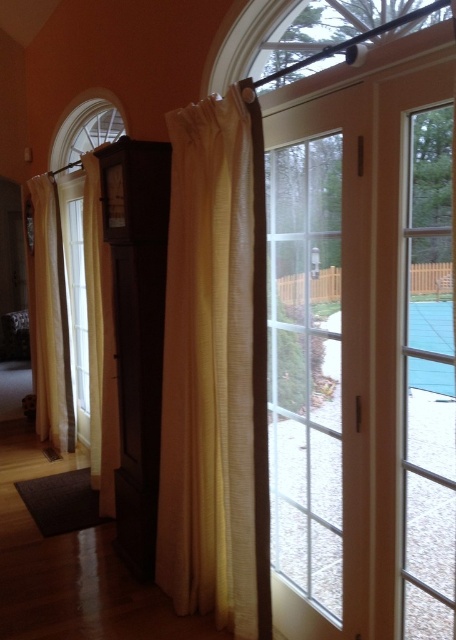
Question: Where is yellow sheer curtain at center located in relation to beige textured curtain at left in the image?

Choices:
 (A) right
 (B) left

Answer: (A)

Question: Does light beige sheer curtain at left come in front of beige textured curtain at left?

Choices:
 (A) yes
 (B) no

Answer: (B)

Question: Which of these objects is positioned closest to the yellow sheer curtain at center?

Choices:
 (A) light beige sheer curtain at left
 (B) clear glass door at right
 (C) beige textured curtain at left

Answer: (B)

Question: Does yellow sheer curtain at center appear on the left side of light beige sheer curtain at left?

Choices:
 (A) no
 (B) yes

Answer: (A)

Question: Estimate the real-world distances between objects in this image. Which object is closer to the beige textured curtain at left?

Choices:
 (A) yellow sheer curtain at center
 (B) clear glass door at right

Answer: (A)

Question: Which point is closer to the camera?

Choices:
 (A) light beige sheer curtain at left
 (B) beige textured curtain at left
 (C) yellow sheer curtain at center

Answer: (C)